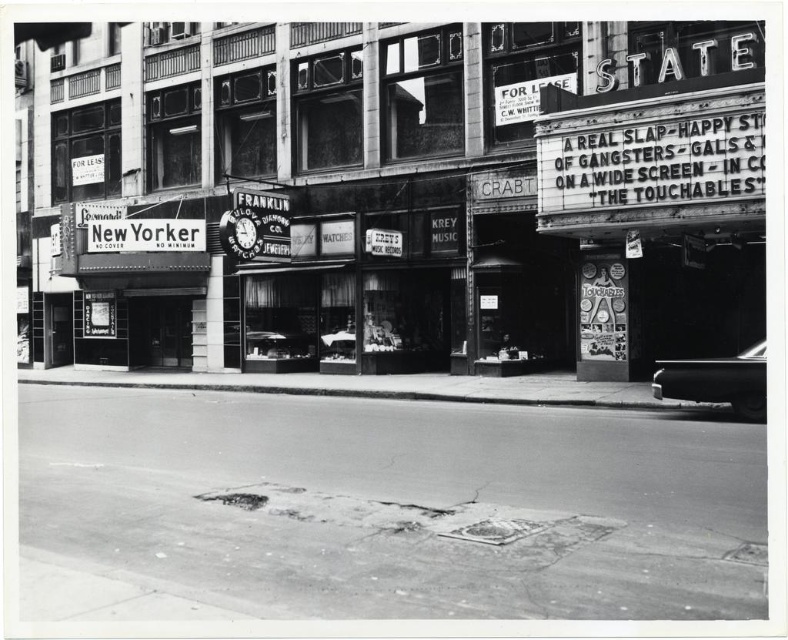
Question: Does neon sign theater at upper right appear under shiny black car at right?

Choices:
 (A) no
 (B) yes

Answer: (A)

Question: Which point is farther from the camera taking this photo?

Choices:
 (A) (720, 390)
 (B) (621, 310)

Answer: (B)

Question: Which point is closer to the camera?

Choices:
 (A) neon sign theater at upper right
 (B) shiny black car at right

Answer: (B)

Question: Where is neon sign theater at upper right located in relation to shiny black car at right in the image?

Choices:
 (A) right
 (B) left

Answer: (B)

Question: Does neon sign theater at upper right appear over shiny black car at right?

Choices:
 (A) no
 (B) yes

Answer: (B)